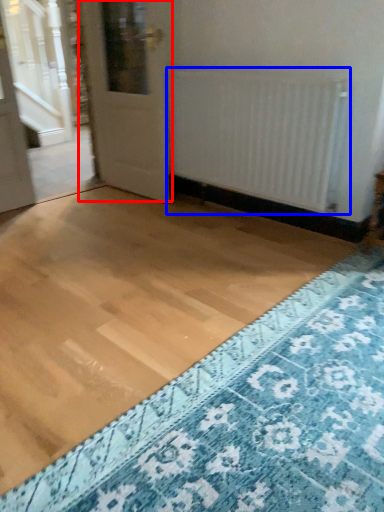
Question: Among these objects, which one is farthest to the camera, door (highlighted by a red box) or radiator (highlighted by a blue box)?

Choices:
 (A) door
 (B) radiator

Answer: (A)